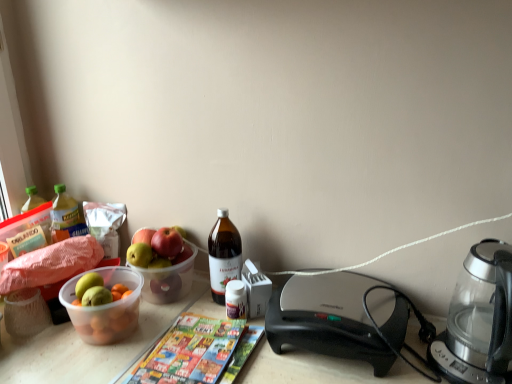
Identify the location of vacant point above multicolored glossy magazine at center (from a real-world perspective). The width and height of the screenshot is (512, 384). (197, 349).